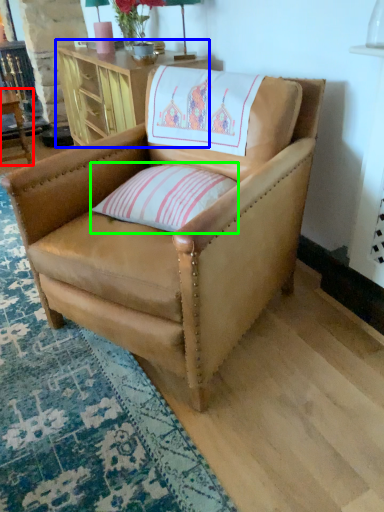
Question: Estimate the real-world distances between objects in this image. Which object is farther from table (highlighted by a red box), table (highlighted by a blue box) or pillow (highlighted by a green box)?

Choices:
 (A) table
 (B) pillow

Answer: (B)